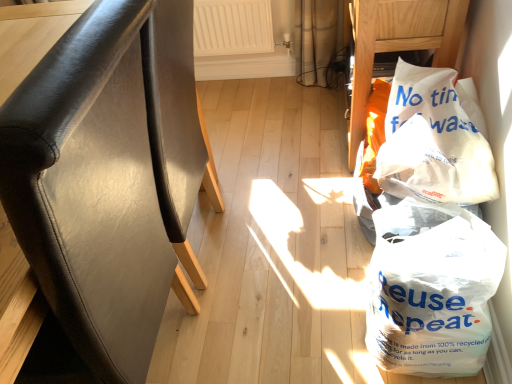
Question: From the image's perspective, is white paper bag at upper right, which is the 2th furniture in left-to-right order, located beneath white plastic bag at lower right, marked as the 1th plastic bag in a bottom-to-top arrangement?

Choices:
 (A) no
 (B) yes

Answer: (A)

Question: Is white paper bag at upper right, which is the second furniture in front-to-back order, to the left of white plastic bag at lower right, the 2th plastic bag when ordered from top to bottom, from the viewer's perspective?

Choices:
 (A) yes
 (B) no

Answer: (B)

Question: From a real-world perspective, is white paper bag at upper right, the 1th furniture in the right-to-left sequence, physically below white plastic bag at lower right, marked as the 1th plastic bag in a bottom-to-top arrangement?

Choices:
 (A) yes
 (B) no

Answer: (B)

Question: Can you confirm if white paper bag at upper right, which is the second furniture in front-to-back order, is wider than white plastic bag at lower right, marked as the 1th plastic bag in a bottom-to-top arrangement?

Choices:
 (A) yes
 (B) no

Answer: (A)

Question: Can you confirm if white paper bag at upper right, which ranks as the 1th furniture in top-to-bottom order, is shorter than white plastic bag at lower right, the 2th plastic bag when ordered from top to bottom?

Choices:
 (A) yes
 (B) no

Answer: (B)

Question: From a real-world perspective, is white paper bag at upper right, placed as the 1th furniture when sorted from back to front, on white plastic bag at lower right, marked as the 1th plastic bag in a bottom-to-top arrangement?

Choices:
 (A) yes
 (B) no

Answer: (A)

Question: Does black leather chair at left, arranged as the second furniture when viewed from the back, touch white paper bag at upper right, which ranks as the 1th furniture in top-to-bottom order?

Choices:
 (A) yes
 (B) no

Answer: (B)

Question: Is black leather chair at left, which appears as the first furniture when ordered from the bottom, further to the viewer compared to white paper bag at upper right, which ranks as the 1th furniture in top-to-bottom order?

Choices:
 (A) no
 (B) yes

Answer: (A)

Question: Does black leather chair at left, the second furniture from the right, have a greater width compared to white paper bag at upper right, placed as the 1th furniture when sorted from back to front?

Choices:
 (A) no
 (B) yes

Answer: (A)

Question: From the image's perspective, is black leather chair at left, which appears as the first furniture when ordered from the bottom, beneath white paper bag at upper right, placed as the 1th furniture when sorted from back to front?

Choices:
 (A) no
 (B) yes

Answer: (B)

Question: From a real-world perspective, does black leather chair at left, the second furniture from the right, stand above white paper bag at upper right, which ranks as the 1th furniture in top-to-bottom order?

Choices:
 (A) yes
 (B) no

Answer: (A)

Question: From the image's perspective, is black leather chair at left, which is the first furniture in front-to-back order, on top of white paper bag at upper right, the 1th furniture in the right-to-left sequence?

Choices:
 (A) no
 (B) yes

Answer: (A)

Question: From the image's perspective, is white plastic bag at lower right, the 2th plastic bag when ordered from top to bottom, beneath white paper bag at right, which is the 2th plastic bag in bottom-to-top order?

Choices:
 (A) no
 (B) yes

Answer: (B)